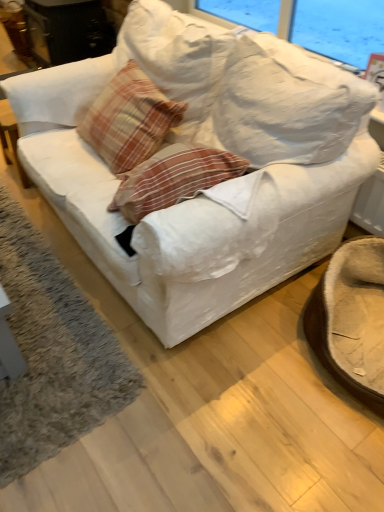
Find the location of a particular element. Image resolution: width=384 pixels, height=512 pixels. vacant area to the left of brown fuzzy swivel chair at lower right is located at coordinates coord(244,372).